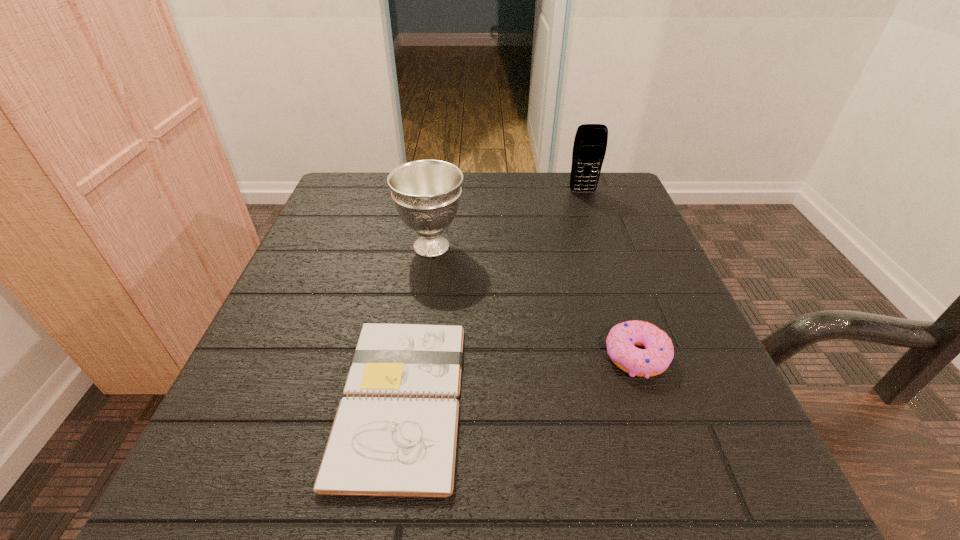
This screenshot has width=960, height=540. I want to click on vacant area between the second shortest object and the notepad, so [518, 378].

This screenshot has width=960, height=540. Find the location of `free spot between the second farthest object and the doughnut`. free spot between the second farthest object and the doughnut is located at coordinates (534, 301).

Find the location of a particular element. free space between the notepad and the chalice is located at coordinates (417, 323).

This screenshot has height=540, width=960. Find the location of `object that is the second closest one to the third nearest object`. object that is the second closest one to the third nearest object is located at coordinates coord(590,143).

Point out which object is positioned as the third nearest to the farthest object. Please provide its 2D coordinates. Your answer should be formatted as a tuple, i.e. [(x, y)], where the tuple contains the x and y coordinates of a point satisfying the conditions above.

[(395, 433)]

Where is `vacant space that satisfies the following two spatial constraints: 1. on the back side of the chalice; 2. on the right side of the shortest object`? The width and height of the screenshot is (960, 540). vacant space that satisfies the following two spatial constraints: 1. on the back side of the chalice; 2. on the right side of the shortest object is located at coordinates (425, 246).

You are a GUI agent. You are given a task and a screenshot of the screen. Output one action in this format:
    pyautogui.click(x=<x>, y=<y>)
    Task: Click on the blank space that satisfies the following two spatial constraints: 1. on the back side of the shortest object; 2. on the right side of the third tallest object
    The height and width of the screenshot is (540, 960).
    Given the screenshot: What is the action you would take?
    pyautogui.click(x=408, y=356)